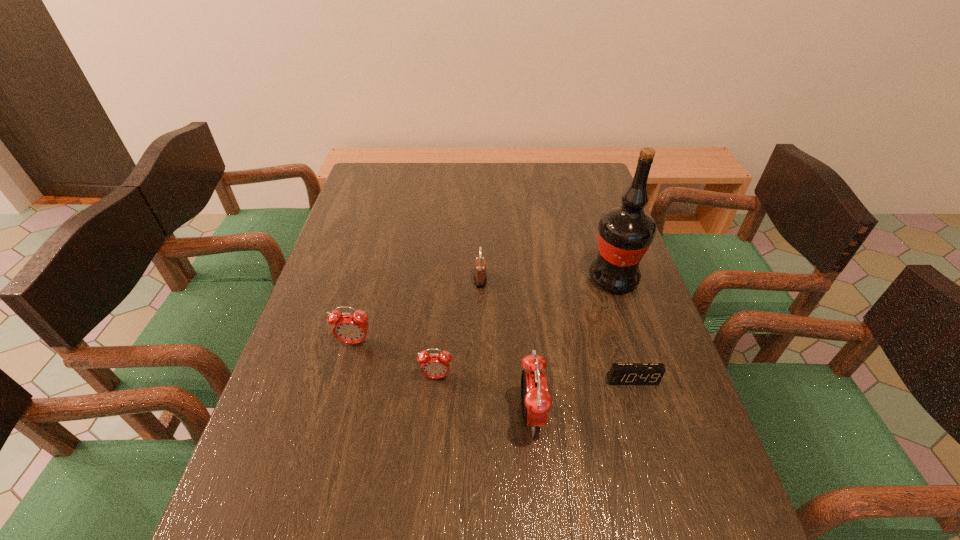
The width and height of the screenshot is (960, 540). Find the location of `vacant space that's between the shortest object and the wine bottle`. vacant space that's between the shortest object and the wine bottle is located at coordinates (623, 329).

Locate an element on the screen. empty space that is in between the second tallest object and the third farthest object is located at coordinates point(443,379).

The width and height of the screenshot is (960, 540). What are the coordinates of `vacant space in between the leftmost object and the fourth object from right to left` in the screenshot? It's located at point(418,311).

Locate an element on the screen. vacant space in between the shortest alarm clock and the third farthest object is located at coordinates (493, 361).

You are a GUI agent. You are given a task and a screenshot of the screen. Output one action in this format:
    pyautogui.click(x=<x>, y=<y>)
    Task: Click on the free space between the second tallest alarm clock and the tallest alarm clock
    This screenshot has width=960, height=540.
    Given the screenshot: What is the action you would take?
    pyautogui.click(x=443, y=379)

In order to click on object that is the closest one to the third farthest object in this screenshot , I will do `click(434, 365)`.

Where is `object that stands as the fifth closest to the second shortest alarm clock`? object that stands as the fifth closest to the second shortest alarm clock is located at coordinates (625, 232).

Select which alarm clock is the third closest to the tallest object. Please provide its 2D coordinates. Your answer should be formatted as a tuple, i.e. [(x, y)], where the tuple contains the x and y coordinates of a point satisfying the conditions above.

[(434, 365)]

You are a GUI agent. You are given a task and a screenshot of the screen. Output one action in this format:
    pyautogui.click(x=<x>, y=<y>)
    Task: Click on the second closest alarm clock relative to the padlock
    Image resolution: width=960 pixels, height=540 pixels.
    Given the screenshot: What is the action you would take?
    pyautogui.click(x=351, y=328)

I want to click on vacant space that satisfies the following two spatial constraints: 1. on the front-facing side of the rightmost alarm clock; 2. on the face of the tallest alarm clock, so click(643, 416).